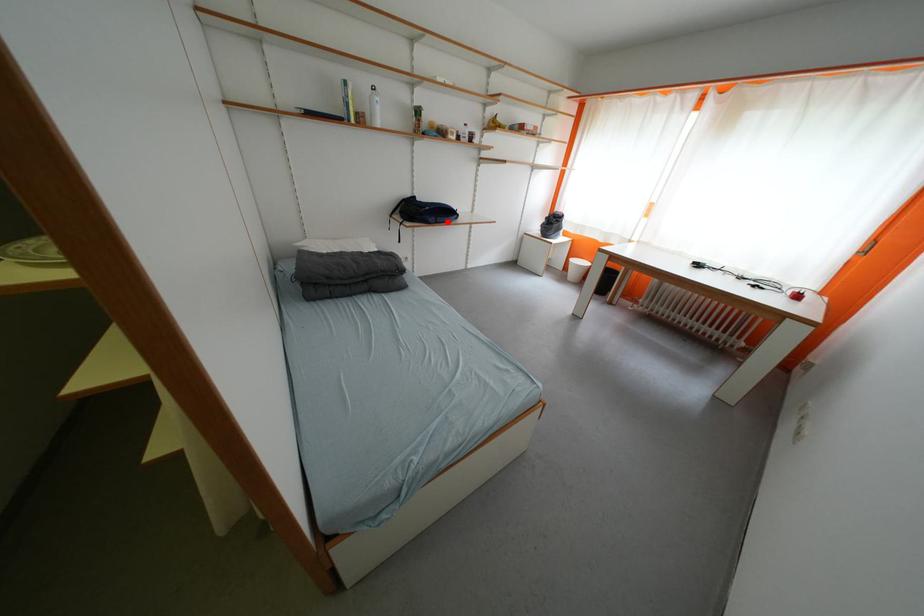
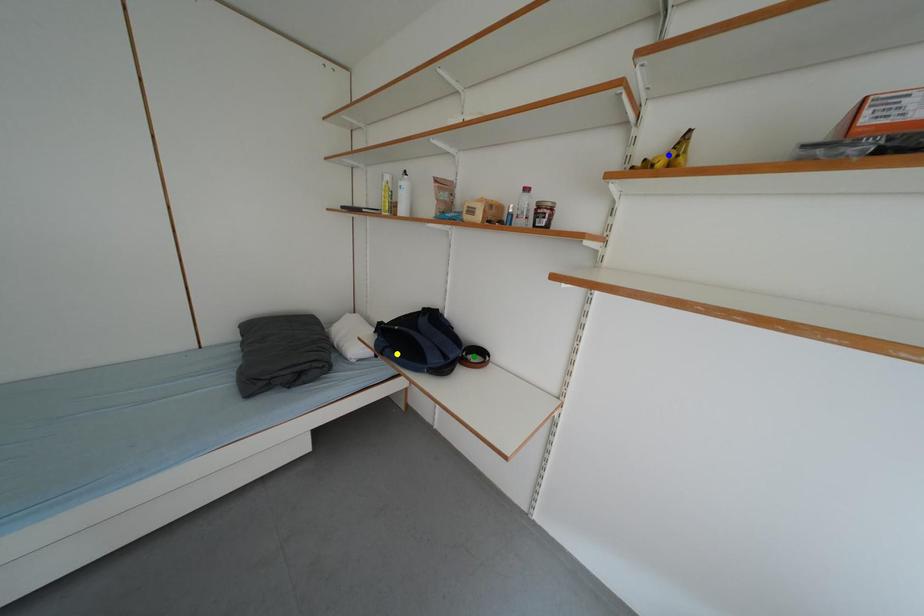
Question: I am providing you with two images of the same scene from different viewpoints. A red point is marked on the first image. You are given multiple points on the second image. Which point in image 2 is actually the same real-world point as the red point in image 1?

Choices:
 (A) blue point
 (B) green point
 (C) yellow point

Answer: (C)